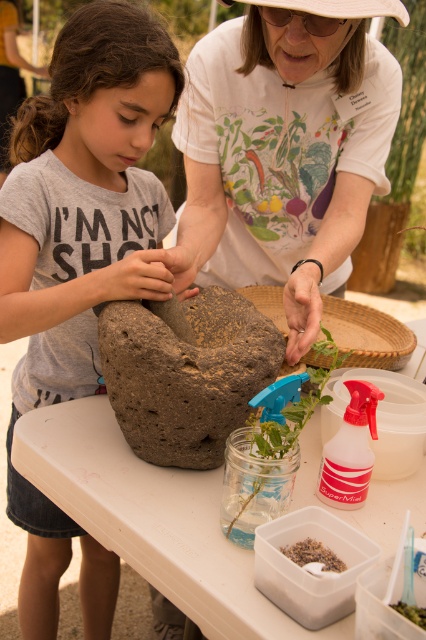
You are standing in the garden and see two points marked on the ground. The first point is at coordinates point (161, 280) and the second is at point (255, 435). Which point is closer to you?

Point (161, 280) is closer to you because it is further to the viewer than point (255, 435).

Consider the image. You are a gardener who needs to place a small plant between the brown rough stone at center and the translucent glass jar at center on the table. Can you fit the plant in the space between them if the plant requires 5 inches of space?

The brown rough stone at center and the translucent glass jar at center are 4.84 inches apart. Since the plant requires 5 inches of space, the space between them is insufficient. The plant cannot be placed there.

You are a gardener trying to place a new plant between the brown rough stone at center and the translucent glass jar at center. Which object should you place the plant closer to if you want it to be on the right side of the stone?

You should place the plant closer to the translucent glass jar at center because the brown rough stone at center is on the left side of the jar.